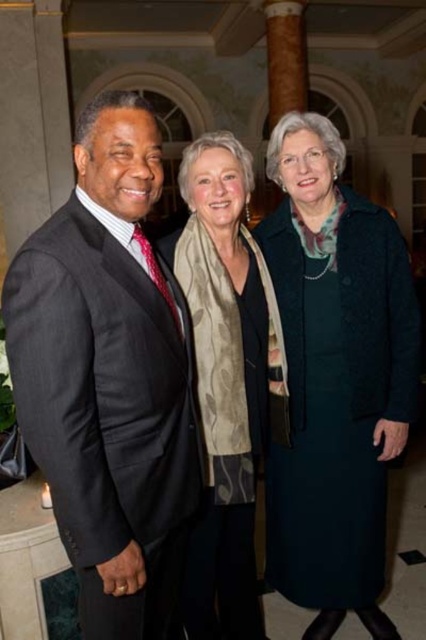
Does matte black suit at left have a smaller size compared to dark green wool coat at center?

No, matte black suit at left is not smaller than dark green wool coat at center.

Is matte black suit at left closer to camera compared to dark green wool coat at center?

Yes, it is in front of dark green wool coat at center.

Does point (103, 164) come in front of point (391, 291)?

Yes, point (103, 164) is in front of point (391, 291).

Image resolution: width=426 pixels, height=640 pixels. I want to click on matte black suit at left, so click(x=109, y=378).

Which is in front, point (8, 360) or point (268, 305)?

Point (8, 360) is in front.

Who is lower down, matte black suit at left or beige floral scarf at center?

matte black suit at left

Locate an element on the screen. matte black suit at left is located at coordinates (109, 378).

Does point (324, 141) come closer to viewer compared to point (189, 145)?

Yes, it is.

Which is in front, point (340, 452) or point (218, 506)?

Positioned in front is point (218, 506).

Is point (382, 380) more distant than point (267, 422)?

No, (382, 380) is in front of (267, 422).

The image size is (426, 640). Identify the location of dark green wool coat at center. (336, 378).